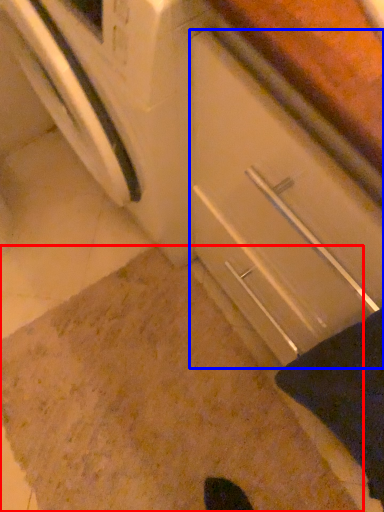
Question: Among these objects, which one is farthest to the camera, granite (highlighted by a red box) or drawer (highlighted by a blue box)?

Choices:
 (A) granite
 (B) drawer

Answer: (A)